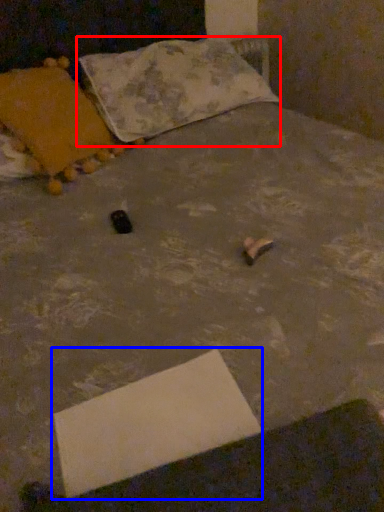
Question: Which of the following is the closest to the observer, pillow (highlighted by a red box) or cardboard box (highlighted by a blue box)?

Choices:
 (A) pillow
 (B) cardboard box

Answer: (B)